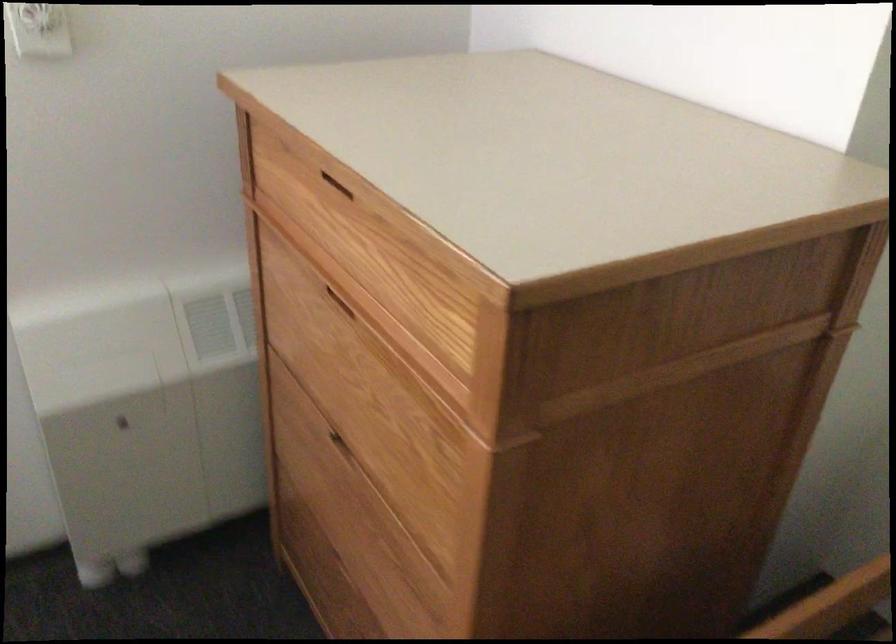
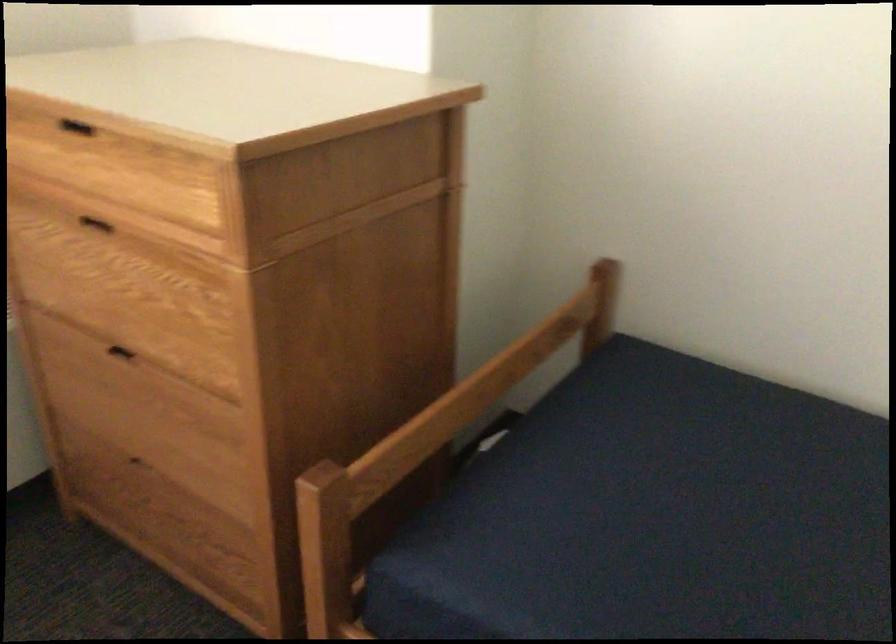
Locate, in the second image, the point that corresponds to (341,438) in the first image.

(119, 352)